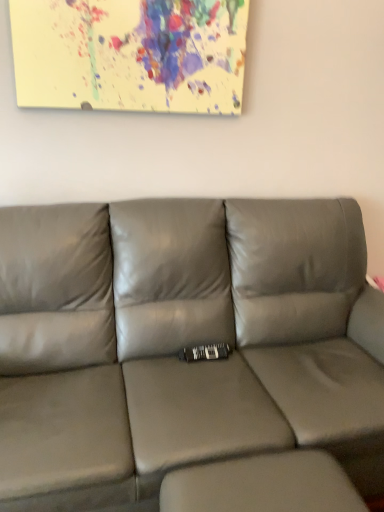
Question: From a real-world perspective, is gray leather footrest at lower right beneath satin gray leather couch at center?

Choices:
 (A) yes
 (B) no

Answer: (A)

Question: Would you say gray leather footrest at lower right contains satin gray leather couch at center?

Choices:
 (A) no
 (B) yes

Answer: (A)

Question: Is gray leather footrest at lower right at the right side of satin gray leather couch at center?

Choices:
 (A) no
 (B) yes

Answer: (B)

Question: Does gray leather footrest at lower right come behind satin gray leather couch at center?

Choices:
 (A) yes
 (B) no

Answer: (A)

Question: Is gray leather footrest at lower right thinner than satin gray leather couch at center?

Choices:
 (A) yes
 (B) no

Answer: (A)

Question: Would you say gray leather footrest at lower right is a long distance from satin gray leather couch at center?

Choices:
 (A) no
 (B) yes

Answer: (A)

Question: Is there a large distance between satin gray leather couch at center and gray leather footrest at lower right?

Choices:
 (A) yes
 (B) no

Answer: (B)

Question: Considering the relative sizes of satin gray leather couch at center and gray leather footrest at lower right in the image provided, is satin gray leather couch at center wider than gray leather footrest at lower right?

Choices:
 (A) yes
 (B) no

Answer: (A)

Question: From a real-world perspective, is satin gray leather couch at center on top of gray leather footrest at lower right?

Choices:
 (A) no
 (B) yes

Answer: (B)

Question: From the image's perspective, would you say satin gray leather couch at center is shown under gray leather footrest at lower right?

Choices:
 (A) yes
 (B) no

Answer: (B)

Question: Does satin gray leather couch at center have a lesser height compared to gray leather footrest at lower right?

Choices:
 (A) no
 (B) yes

Answer: (A)

Question: Does satin gray leather couch at center appear on the right side of gray leather footrest at lower right?

Choices:
 (A) no
 (B) yes

Answer: (A)

Question: Is satin gray leather couch at center in front of or behind gray leather footrest at lower right in the image?

Choices:
 (A) behind
 (B) front

Answer: (B)